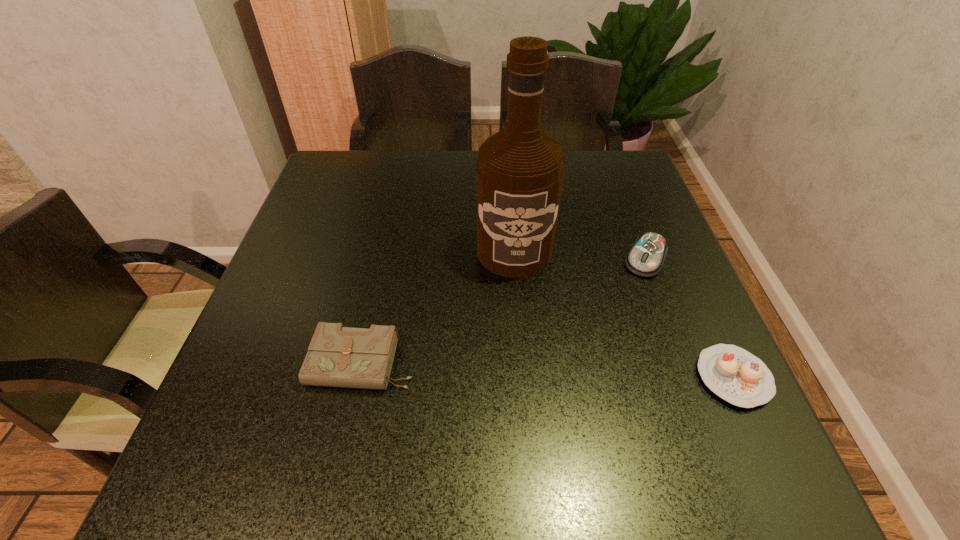
In the image, there is a desktop. Identify the location of vacant space at the far edge. The height and width of the screenshot is (540, 960). (387, 183).

Where is `blank area at the near edge`? The image size is (960, 540). blank area at the near edge is located at coordinates (480, 402).

Identify the location of vacant space at the left edge of the desktop. pyautogui.click(x=313, y=272).

In the image, there is a desktop. Where is `vacant space at the right edge`? The height and width of the screenshot is (540, 960). vacant space at the right edge is located at coordinates (656, 299).

Locate an element on the screen. The width and height of the screenshot is (960, 540). free spot at the far left corner of the desktop is located at coordinates (359, 180).

Identify the location of free space at the near right corner of the desktop. This screenshot has height=540, width=960. (719, 402).

Image resolution: width=960 pixels, height=540 pixels. I want to click on vacant space that's between the computer mouse and the diary, so click(504, 311).

The image size is (960, 540). Identify the location of vacant area between the diary and the computer mouse. (504, 311).

The image size is (960, 540). Identify the location of free space between the leftmost object and the cupcake. (548, 370).

What are the coordinates of `free space that is in between the computer mouse and the alcohol` in the screenshot? It's located at (580, 255).